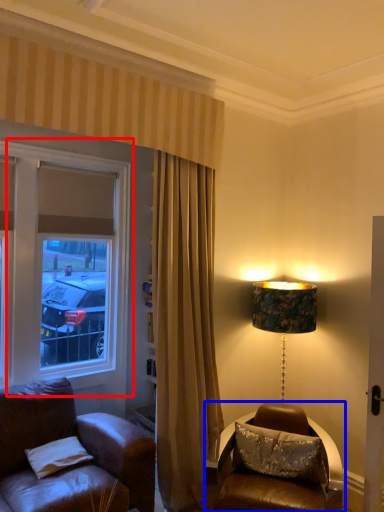
Question: Which of the following is the farthest to the observer, window (highlighted by a red box) or table (highlighted by a blue box)?

Choices:
 (A) window
 (B) table

Answer: (A)